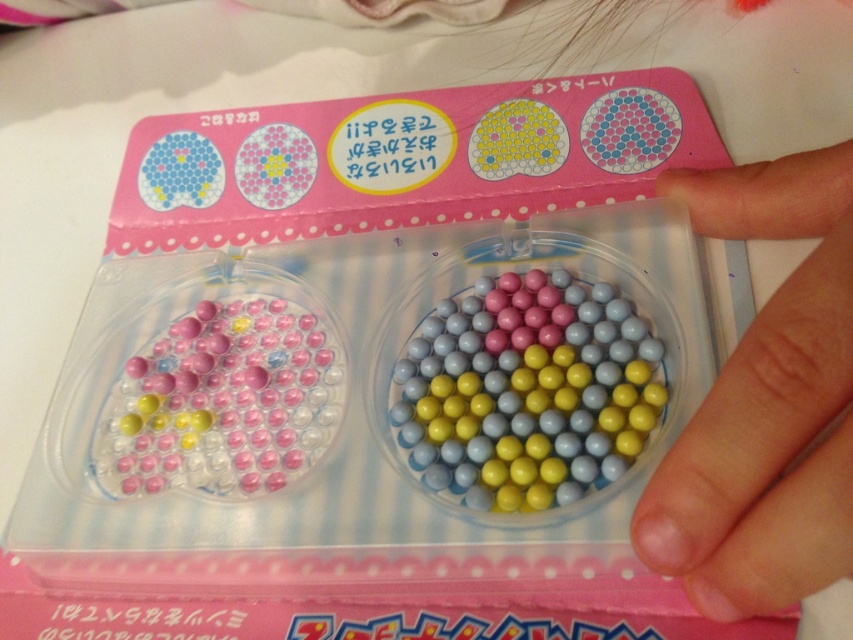
Question: Based on their relative distances, which object is nearer to the glossy plastic beads at center?

Choices:
 (A) matte plastic beads at center
 (B) smooth skin at lower right

Answer: (B)

Question: Based on their relative distances, which object is farther from the smooth skin at lower right?

Choices:
 (A) matte plastic beads at center
 (B) glossy plastic beads at center

Answer: (A)

Question: Does glossy plastic beads at center appear under matte plastic beads at center?

Choices:
 (A) no
 (B) yes

Answer: (A)

Question: Which point is closer to the camera?

Choices:
 (A) (537, 273)
 (B) (756, 180)

Answer: (B)

Question: Can you confirm if smooth skin at lower right is smaller than glossy plastic beads at center?

Choices:
 (A) yes
 (B) no

Answer: (B)

Question: Is smooth skin at lower right thinner than matte plastic beads at center?

Choices:
 (A) no
 (B) yes

Answer: (B)